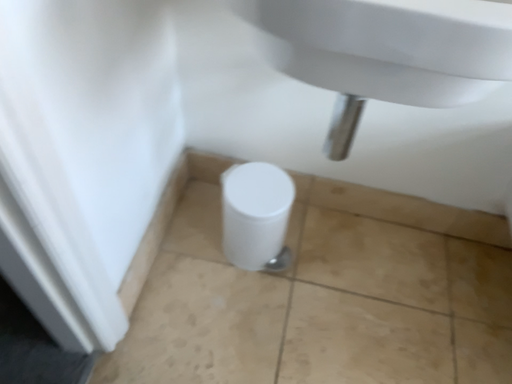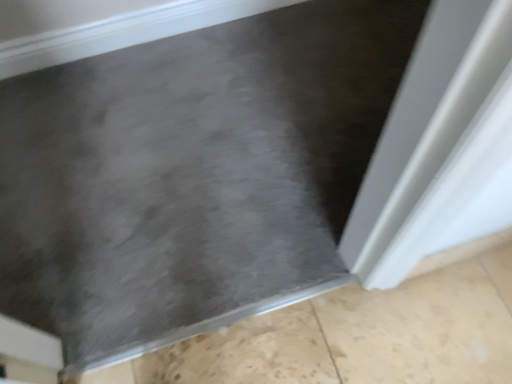
Question: Which way did the camera rotate in the video?

Choices:
 (A) rotated left
 (B) rotated right

Answer: (A)